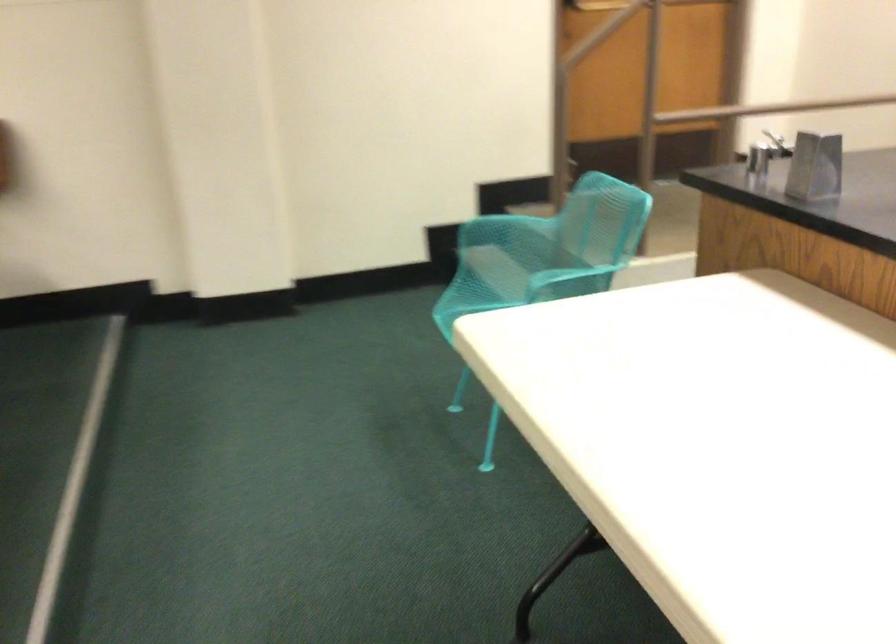
Locate an element on the screen. Image resolution: width=896 pixels, height=644 pixels. turquoise sitting surface is located at coordinates (487, 289).